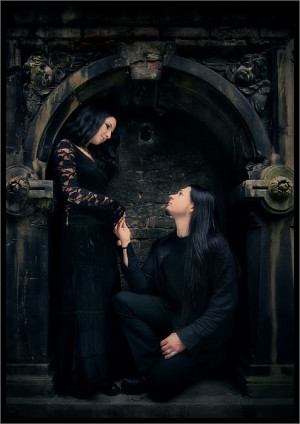
Where is `stone brick wall`? The width and height of the screenshot is (300, 424). stone brick wall is located at coordinates (145, 183).